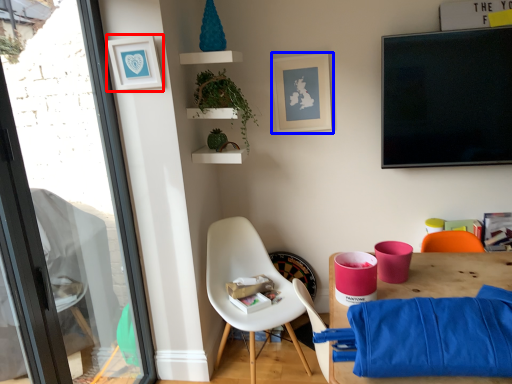
Question: Among these objects, which one is nearest to the camera, picture frame (highlighted by a red box) or picture frame (highlighted by a blue box)?

Choices:
 (A) picture frame
 (B) picture frame

Answer: (A)